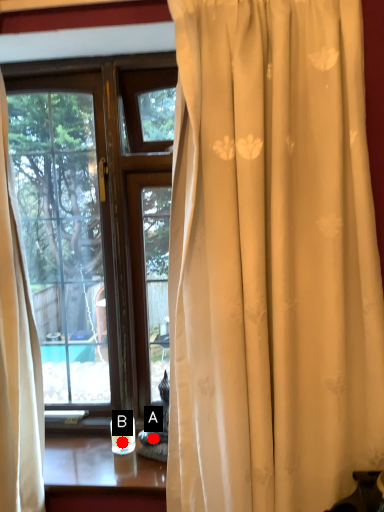
Question: Two points are circled on the image, labeled by A and B beside each circle. Among these points, which one is farthest from the camera?

Choices:
 (A) A is further
 (B) B is further

Answer: (A)